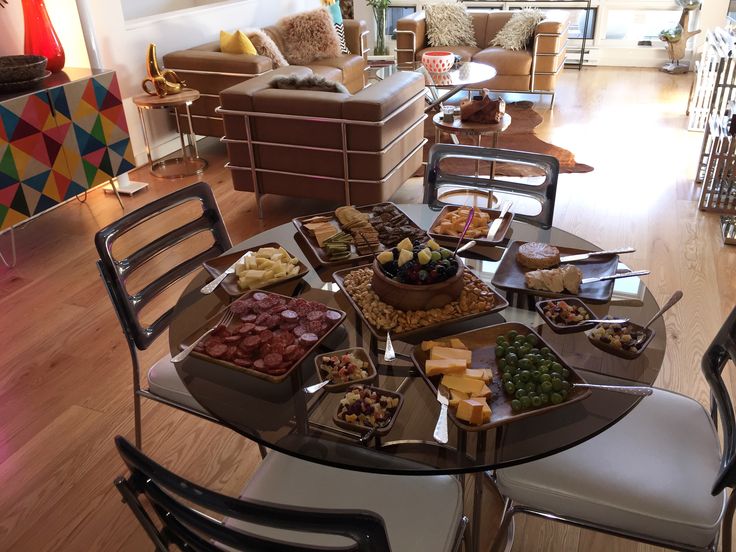
At what (x,y) coordinates should I click in order to perform the action: click on window. Please return your answer as a coordinate pair (x, y). This screenshot has height=552, width=736. Looking at the image, I should click on (637, 15).